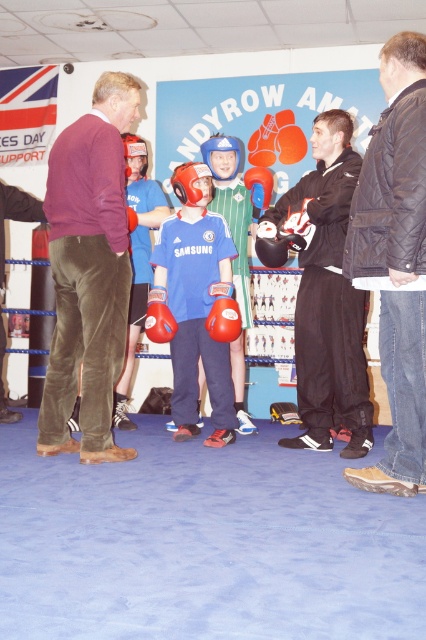
You are a trainer in the boxing gym and need to place a rack for equipment. The rack can only hold items up to the width of the red matte boxing glove at center. Can the black quilted jacket at right fit into the rack?

The black quilted jacket at right is wider than the red matte boxing glove at center, so it cannot fit into the rack designed for items up to the glove width.

You are standing at the entrance of the boxing gym and see the point at coordinates (x=396, y=260). What object is located at that point?

The object at point (x=396, y=260) is the black quilted jacket at right.